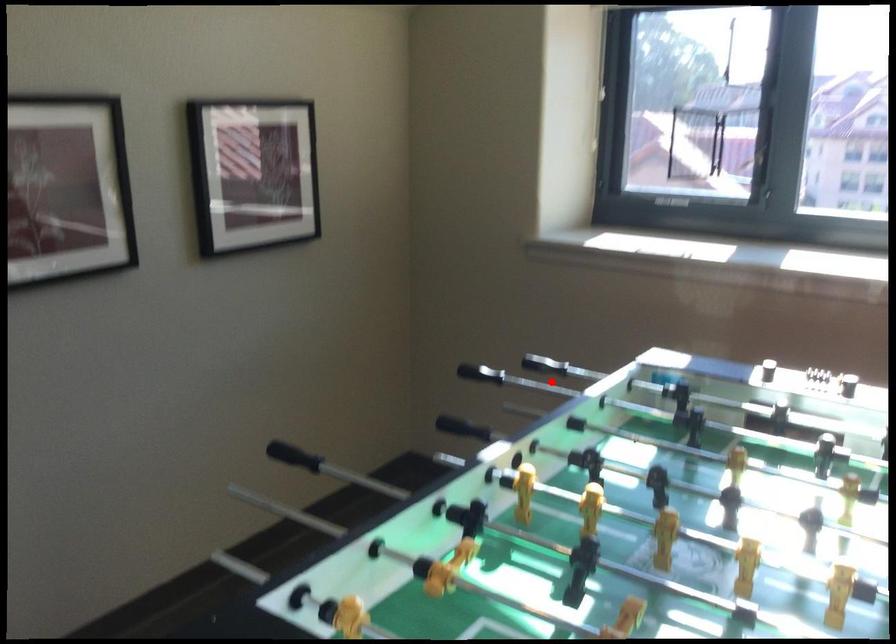
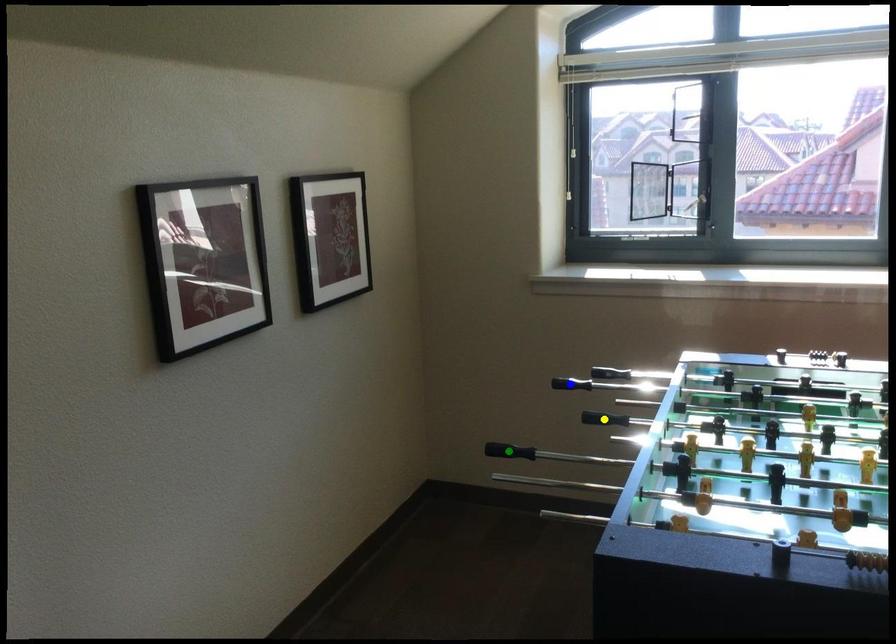
Question: I am providing you with two images of the same scene from different viewpoints. A red point is marked on the first image. You are given multiple points on the second image. Can you choose the point in image 2 that corresponds to the point in image 1?

Choices:
 (A) yellow point
 (B) green point
 (C) blue point

Answer: (C)